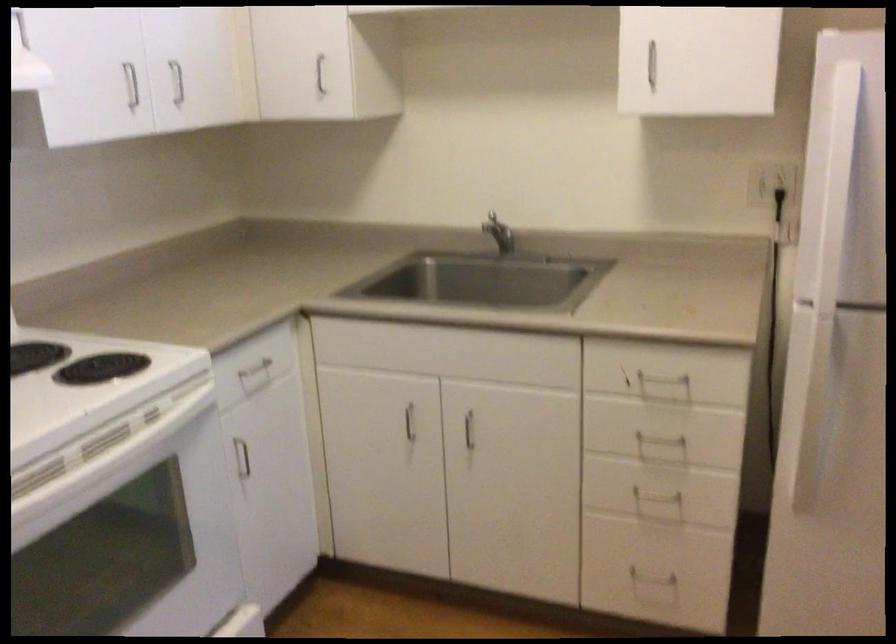
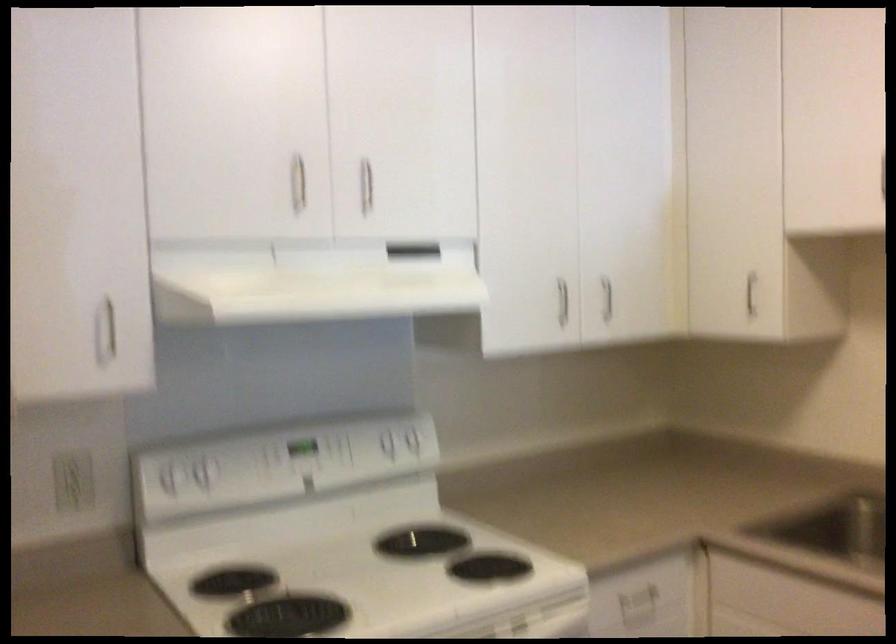
Locate, in the second image, the point that corresponds to (124,82) in the first image.

(562, 301)